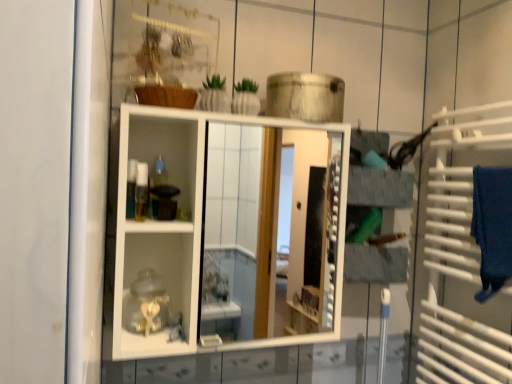
Question: From a real-world perspective, is translucent plastic container at center physically located above or below white metal towel rack at right?

Choices:
 (A) below
 (B) above

Answer: (B)

Question: From the image's perspective, is translucent plastic container at center positioned above or below white metal towel rack at right?

Choices:
 (A) above
 (B) below

Answer: (A)

Question: Which object is positioned farthest from the white glossy cabinet at center?

Choices:
 (A) translucent plastic container at center
 (B) white metal towel rack at right
 (C) blue fabric bath towel at right

Answer: (A)

Question: Which of these objects is positioned farthest from the white metal towel rack at right?

Choices:
 (A) blue fabric bath towel at right
 (B) translucent plastic container at center
 (C) white glossy cabinet at center

Answer: (C)